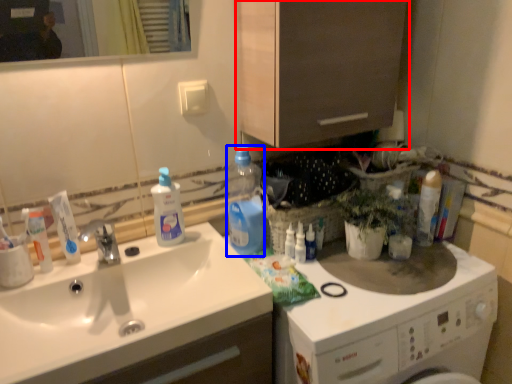
Question: Which object appears farthest to the camera in this image, cabinetry (highlighted by a red box) or cleaning product (highlighted by a blue box)?

Choices:
 (A) cabinetry
 (B) cleaning product

Answer: (B)